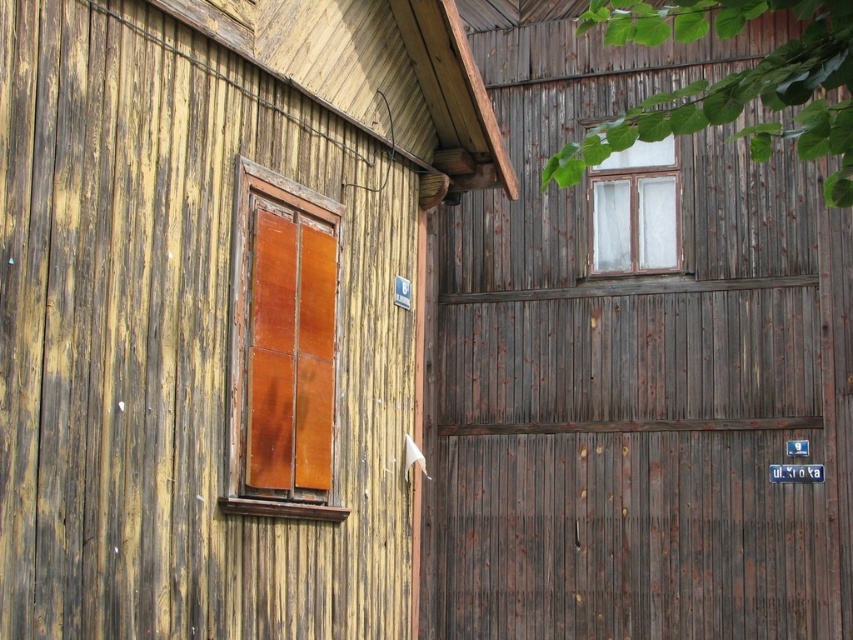
Is wooden panel at left to the right of transparent glass window at upper center from the viewer's perspective?

In fact, wooden panel at left is to the left of transparent glass window at upper center.

Between wooden panel at left and transparent glass window at upper center, which one is positioned lower?

wooden panel at left is below.

What do you see at coordinates (282, 348) in the screenshot? I see `wooden panel at left` at bounding box center [282, 348].

You are a GUI agent. You are given a task and a screenshot of the screen. Output one action in this format:
    pyautogui.click(x=<x>, y=<y>)
    Task: Click on the wooden panel at left
    The width and height of the screenshot is (853, 640).
    Given the screenshot: What is the action you would take?
    pyautogui.click(x=282, y=348)